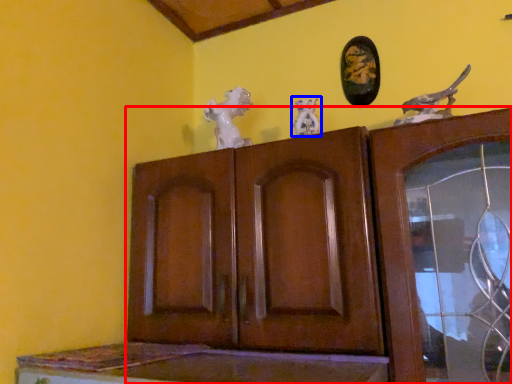
Question: Which of the following is the farthest to the observer, cupboard (highlighted by a red box) or animal sculpture (highlighted by a blue box)?

Choices:
 (A) cupboard
 (B) animal sculpture

Answer: (B)